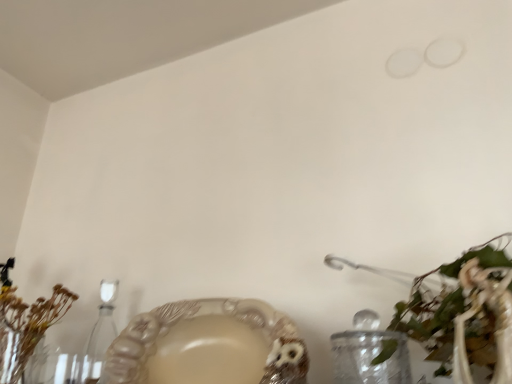
Question: From a real-world perspective, is green leafy plant at lower right, acting as the second floral arrangement starting from the left, located higher than clear glass candle holder at lower left?

Choices:
 (A) yes
 (B) no

Answer: (B)

Question: Could you tell me if green leafy plant at lower right, arranged as the 2th floral arrangement when viewed from the back, is turned towards clear glass candle holder at lower left?

Choices:
 (A) yes
 (B) no

Answer: (B)

Question: Can you confirm if green leafy plant at lower right, the 1th floral arrangement in the front-to-back sequence, is bigger than clear glass candle holder at lower left?

Choices:
 (A) yes
 (B) no

Answer: (A)

Question: From the image's perspective, is green leafy plant at lower right, the first floral arrangement positioned from the right, located above clear glass candle holder at lower left?

Choices:
 (A) yes
 (B) no

Answer: (A)

Question: Can you confirm if green leafy plant at lower right, the 1th floral arrangement in the front-to-back sequence, is taller than clear glass candle holder at lower left?

Choices:
 (A) no
 (B) yes

Answer: (A)

Question: Is the position of green leafy plant at lower right, acting as the second floral arrangement starting from the left, more distant than that of clear glass candle holder at lower left?

Choices:
 (A) yes
 (B) no

Answer: (B)

Question: Is brown dried flowers at left, the 2th floral arrangement when ordered from right to left, to the left of clear glass candle holder at lower left from the viewer's perspective?

Choices:
 (A) yes
 (B) no

Answer: (A)

Question: From the image's perspective, is brown dried flowers at left, which is counted as the 1th floral arrangement, starting from the back, above clear glass candle holder at lower left?

Choices:
 (A) no
 (B) yes

Answer: (B)

Question: From a real-world perspective, is brown dried flowers at left, which is counted as the 1th floral arrangement, starting from the back, over clear glass candle holder at lower left?

Choices:
 (A) yes
 (B) no

Answer: (A)

Question: Is brown dried flowers at left, marked as the second floral arrangement in a front-to-back arrangement, further to camera compared to clear glass candle holder at lower left?

Choices:
 (A) yes
 (B) no

Answer: (B)

Question: Does brown dried flowers at left, marked as the second floral arrangement in a front-to-back arrangement, appear on the right side of clear glass candle holder at lower left?

Choices:
 (A) no
 (B) yes

Answer: (A)

Question: Does brown dried flowers at left, marked as the second floral arrangement in a front-to-back arrangement, lie in front of clear glass candle holder at lower left?

Choices:
 (A) no
 (B) yes

Answer: (B)

Question: From a real-world perspective, is clear glass candle holder at lower left positioned under brown dried flowers at left, which is the first floral arrangement in left-to-right order, based on gravity?

Choices:
 (A) yes
 (B) no

Answer: (A)